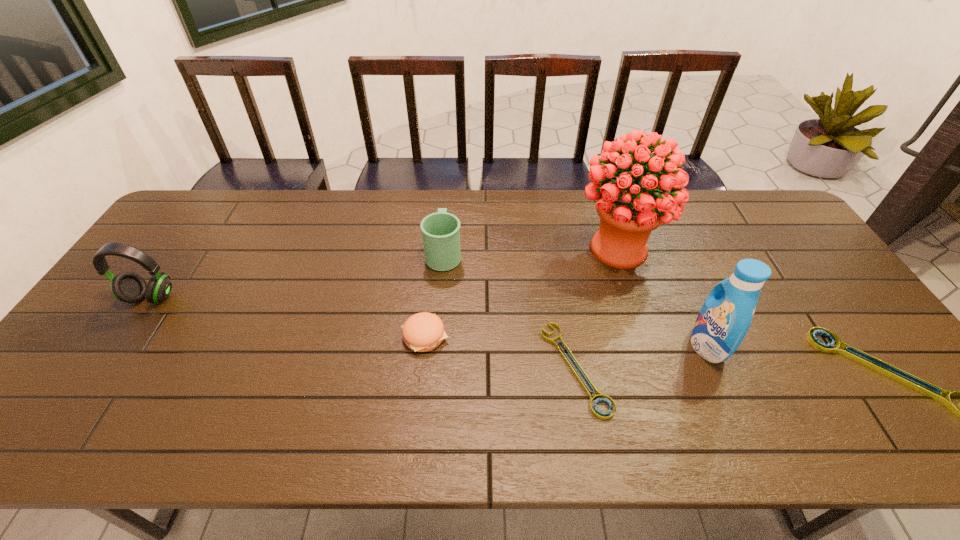
Where is `the left wrench`? the left wrench is located at coordinates (596, 412).

Find the location of a particular element. The width and height of the screenshot is (960, 540). the shorter wrench is located at coordinates 596,412.

The height and width of the screenshot is (540, 960). I want to click on the fourth tallest object, so click(441, 231).

You are a GUI agent. You are given a task and a screenshot of the screen. Output one action in this format:
    pyautogui.click(x=<x>, y=<y>)
    Task: Click on the leftmost object
    This screenshot has width=960, height=540.
    Given the screenshot: What is the action you would take?
    pyautogui.click(x=129, y=287)

At what (x,y) coordinates should I click in order to perform the action: click on the third farthest object. Please return your answer as a coordinate pair (x, y). The image size is (960, 540). Looking at the image, I should click on (129, 287).

Locate an element on the screen. This screenshot has height=540, width=960. the tallest object is located at coordinates (629, 212).

This screenshot has height=540, width=960. Find the location of `the sixth shortest object`. the sixth shortest object is located at coordinates (726, 315).

Find the location of a particular element. The height and width of the screenshot is (540, 960). the fifth tallest object is located at coordinates (422, 332).

At what (x,y) coordinates should I click in order to perform the action: click on vacant position located on the left of the shorter wrench. Please return your answer as a coordinate pair (x, y). The width and height of the screenshot is (960, 540). Looking at the image, I should click on (463, 368).

This screenshot has height=540, width=960. Identify the location of free space located 0.220m on the side of the mug with the handle. (448, 195).